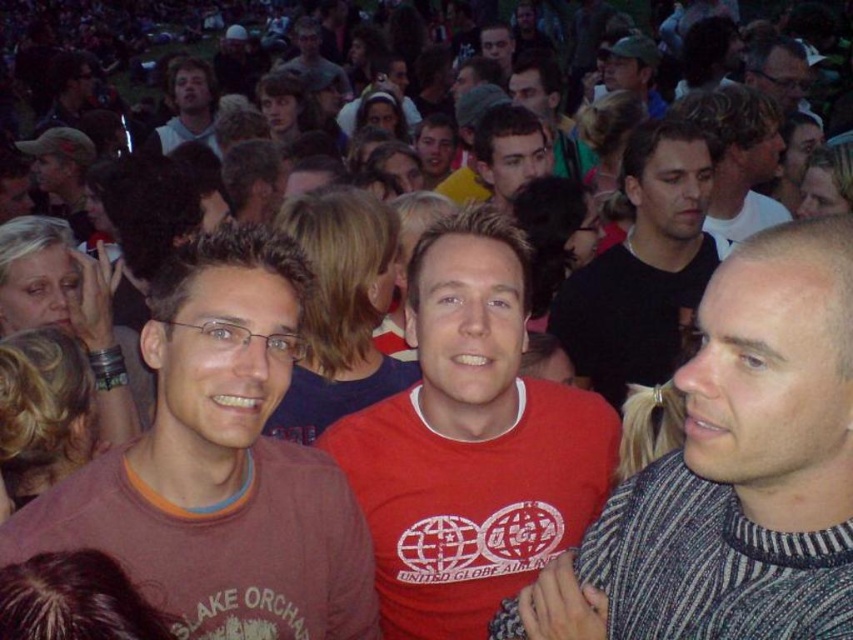
Question: Can you confirm if dark brown hair at center is positioned to the left of light brown hair at upper left?

Choices:
 (A) yes
 (B) no

Answer: (B)

Question: Which point is farther to the camera?

Choices:
 (A) (776, 449)
 (B) (477, 147)
 (C) (346, 518)
 (D) (746, 128)

Answer: (B)

Question: Where is striped sweater at center located in relation to matte black shirt at upper right in the image?

Choices:
 (A) left
 (B) right

Answer: (A)

Question: Does red cotton t-shirt at center lie behind black matte shirt at center?

Choices:
 (A) yes
 (B) no

Answer: (B)

Question: Which of the following is the farthest from the observer?

Choices:
 (A) (525, 116)
 (B) (769, 209)

Answer: (A)

Question: Among these points, which one is nearest to the camera?

Choices:
 (A) (177, 515)
 (B) (657, 524)
 (C) (479, 554)

Answer: (B)